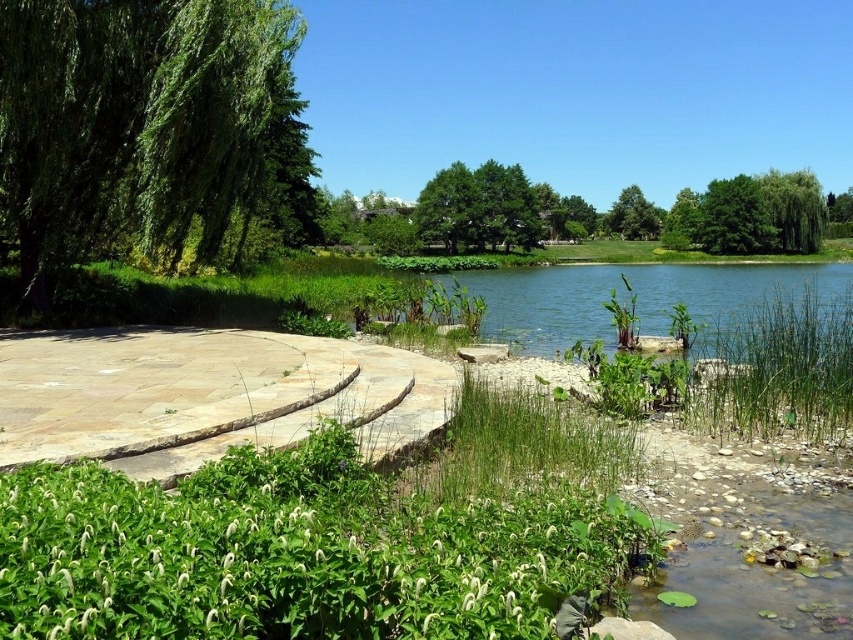
Who is lower down, green leafy tree at center or green leafy tree at upper center?

green leafy tree at center is below.

Can you confirm if green leafy tree at center is positioned above green leafy tree at upper center?

No, green leafy tree at center is not above green leafy tree at upper center.

The width and height of the screenshot is (853, 640). Find the location of `green leafy tree at center`. green leafy tree at center is located at coordinates (479, 209).

Who is positioned more to the right, clear blue water at center or green leafy tree at center?

From the viewer's perspective, clear blue water at center appears more on the right side.

Which of these two, clear blue water at center or green leafy tree at center, stands taller?

green leafy tree at center

Which is in front, point (527, 316) or point (422, 205)?

Point (527, 316)

Find the location of a particular element. The image size is (853, 640). clear blue water at center is located at coordinates (627, 294).

Does green leafy tree at left appear on the left side of natural stone path at center?

Yes, green leafy tree at left is to the left of natural stone path at center.

Which of these two, green leafy tree at left or natural stone path at center, stands taller?

green leafy tree at left

Is point (41, 285) farther from viewer compared to point (0, 435)?

Yes, it is.

At what (x,y) coordinates should I click in order to perform the action: click on green leafy tree at left. Please return your answer as a coordinate pair (x, y). The width and height of the screenshot is (853, 640). Looking at the image, I should click on (135, 120).